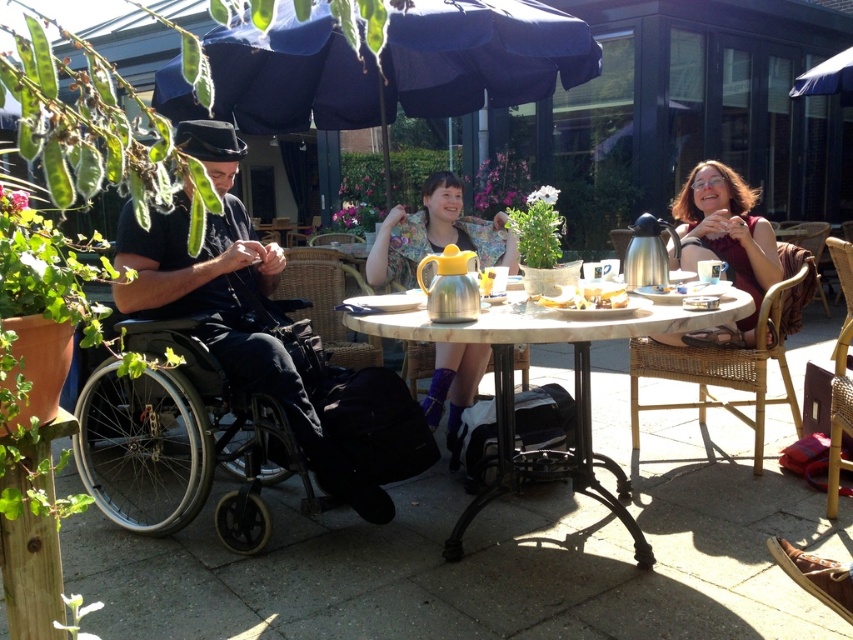
Is marble table at center to the left of metallic silver teapot at center from the viewer's perspective?

No, marble table at center is not to the left of metallic silver teapot at center.

Image resolution: width=853 pixels, height=640 pixels. What do you see at coordinates (573, 392) in the screenshot?
I see `marble table at center` at bounding box center [573, 392].

You are a GUI agent. You are given a task and a screenshot of the screen. Output one action in this format:
    pyautogui.click(x=<x>, y=<y>)
    Task: Click on the marble table at center
    
    Given the screenshot: What is the action you would take?
    pyautogui.click(x=573, y=392)

Can you confirm if marble table at center is positioned to the left of matte brown sweater at upper right?

Indeed, marble table at center is positioned on the left side of matte brown sweater at upper right.

At what (x,y) coordinates should I click in order to perform the action: click on marble table at center. Please return your answer as a coordinate pair (x, y). Looking at the image, I should click on (573, 392).

Find the location of a particular element. The width and height of the screenshot is (853, 640). marble table at center is located at coordinates 573,392.

Who is higher up, dark blue fabric umbrella at upper center or black matte wheelchair at left?

dark blue fabric umbrella at upper center

Between point (564, 54) and point (181, 195), which one is positioned behind?

Positioned behind is point (564, 54).

Is point (477, 93) positioned in front of point (173, 289)?

That is False.

Locate an element on the screen. dark blue fabric umbrella at upper center is located at coordinates (396, 65).